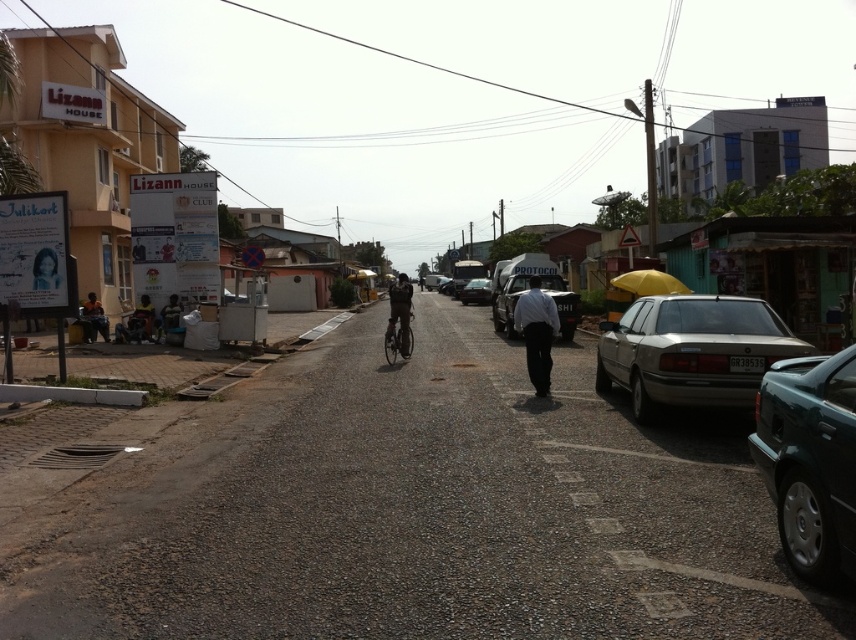
You are standing in the street scene and want to take a photo of both point (x=646, y=289) and point (x=146, y=323). Which point should you focus on first to ensure both are in clear view?

You should focus on point (x=646, y=289) first because it is closer to the camera than point (x=146, y=323). By focusing on the closer point, the farther point will also be in focus due to the depth of field.

You are standing at the center of the street in the image. You need to locate the yellow matte umbrella at right. According to the coordinates given, where exactly should you look to find it?

The yellow matte umbrella at right is located at point 0.442 on the x axis and 0.758 on the y axis.

You are standing at the center of the street and want to park your car at the exact location where the green metallic car at right is currently parked. What are the coordinates of the spot you should aim for?

The coordinates of the spot where the green metallic car at right is parked are at point (810,460).